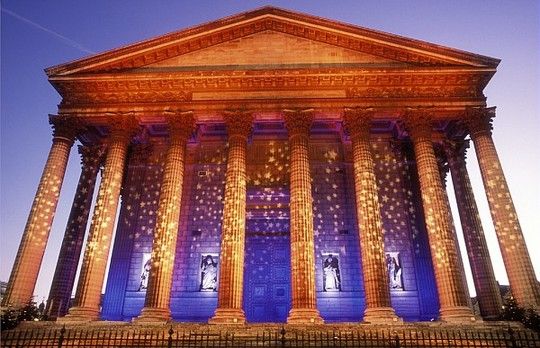
Image resolution: width=540 pixels, height=348 pixels. Identify the location of corner. (40, 13).